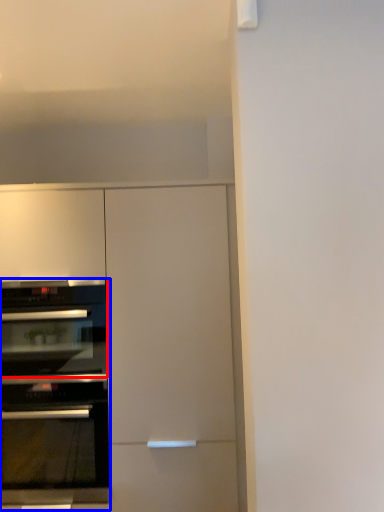
Question: Which object appears closest to the camera in this image, oven (highlighted by a red box) or oven (highlighted by a blue box)?

Choices:
 (A) oven
 (B) oven

Answer: (B)